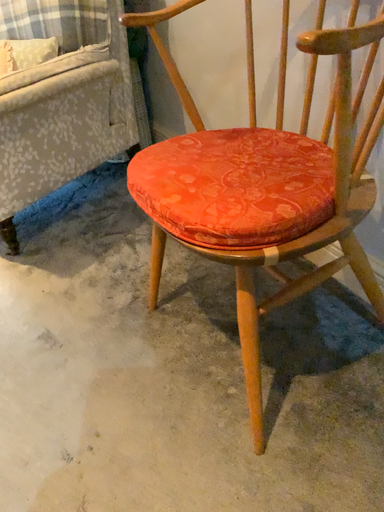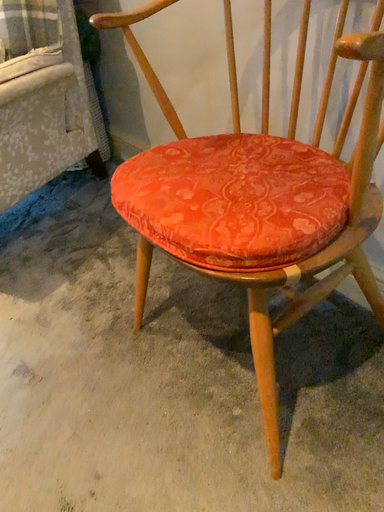
Question: How did the camera likely rotate when shooting the video?

Choices:
 (A) rotated right
 (B) rotated left

Answer: (A)